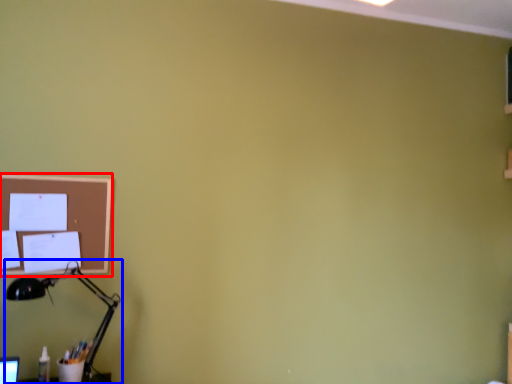
Question: Which object appears closest to the camera in this image, bulletin board (highlighted by a red box) or lamp (highlighted by a blue box)?

Choices:
 (A) bulletin board
 (B) lamp

Answer: (B)